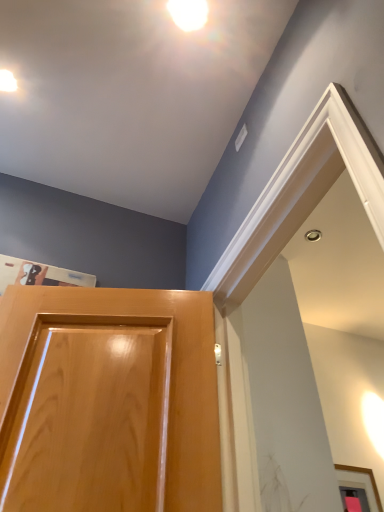
Question: Could you tell me if white glossy droplight at upper center, the first droplight in the front-to-back sequence, is turned towards glossy wood door at lower left?

Choices:
 (A) no
 (B) yes

Answer: (A)

Question: Does white glossy droplight at upper center, the first droplight in the front-to-back sequence, appear on the right side of glossy wood door at lower left?

Choices:
 (A) no
 (B) yes

Answer: (B)

Question: Is white glossy droplight at upper center, the first droplight in the front-to-back sequence, facing away from glossy wood door at lower left?

Choices:
 (A) yes
 (B) no

Answer: (B)

Question: Is white glossy droplight at upper center, acting as the 2th droplight starting from the back, bigger than glossy wood door at lower left?

Choices:
 (A) yes
 (B) no

Answer: (B)

Question: Is white glossy droplight at upper center, the 2th droplight when ordered from bottom to top, beside glossy wood door at lower left?

Choices:
 (A) no
 (B) yes

Answer: (A)

Question: From their relative heights in the image, would you say glossy wood door at lower left is taller or shorter than matte white droplight at upper left, the 2th droplight positioned from the top?

Choices:
 (A) tall
 (B) short

Answer: (A)

Question: Considering the positions of glossy wood door at lower left and matte white droplight at upper left, which is counted as the second droplight, starting from the right, in the image, is glossy wood door at lower left wider or thinner than matte white droplight at upper left, which is counted as the second droplight, starting from the right,?

Choices:
 (A) wide
 (B) thin

Answer: (A)

Question: Choose the correct answer: Is glossy wood door at lower left inside matte white droplight at upper left, which is counted as the first droplight, starting from the bottom, or outside it?

Choices:
 (A) outside
 (B) inside

Answer: (A)

Question: Based on their sizes in the image, would you say glossy wood door at lower left is bigger or smaller than matte white droplight at upper left, which is counted as the first droplight, starting from the bottom?

Choices:
 (A) big
 (B) small

Answer: (A)

Question: Is white glossy droplight at upper center, acting as the first droplight starting from the top, to the left or to the right of glossy wood door at lower left in the image?

Choices:
 (A) right
 (B) left

Answer: (A)

Question: From the image's perspective, relative to glossy wood door at lower left, is white glossy droplight at upper center, the 1th droplight from the right, above or below?

Choices:
 (A) above
 (B) below

Answer: (A)

Question: Do you think white glossy droplight at upper center, the first droplight in the front-to-back sequence, is within glossy wood door at lower left, or outside of it?

Choices:
 (A) inside
 (B) outside

Answer: (B)

Question: Considering the positions of point (196, 13) and point (213, 334), is point (196, 13) closer or farther from the camera than point (213, 334)?

Choices:
 (A) closer
 (B) farther

Answer: (B)

Question: Is point (59, 481) positioned closer to the camera than point (196, 3)?

Choices:
 (A) farther
 (B) closer

Answer: (B)

Question: Relative to white glossy droplight at upper center, the first droplight in the front-to-back sequence, is glossy wood door at lower left in front or behind?

Choices:
 (A) front
 (B) behind

Answer: (A)